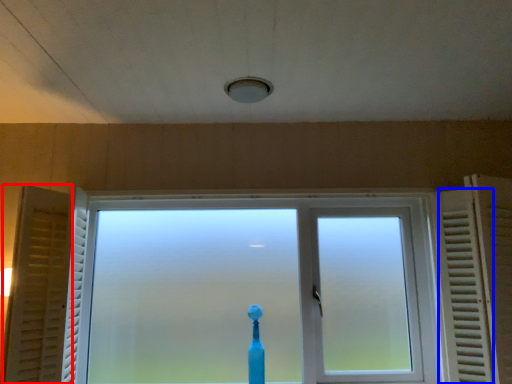
Question: Which object appears farthest to the camera in this image, curtain (highlighted by a red box) or radiator (highlighted by a blue box)?

Choices:
 (A) curtain
 (B) radiator

Answer: (A)